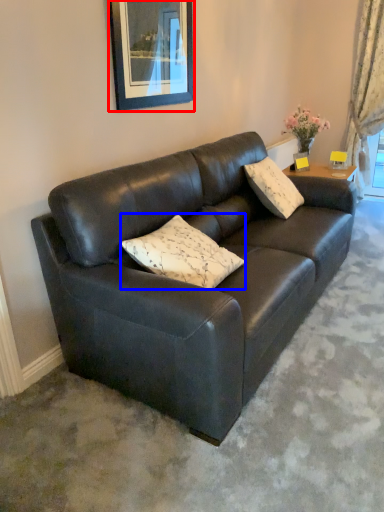
Question: Among these objects, which one is nearest to the camera, picture frame (highlighted by a red box) or pillow (highlighted by a blue box)?

Choices:
 (A) picture frame
 (B) pillow

Answer: (B)